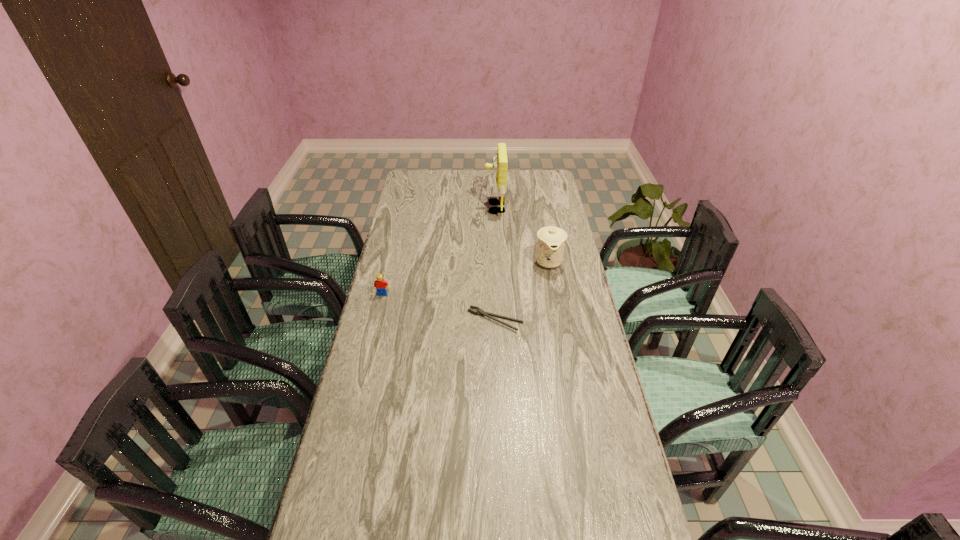
Locate an element on the screen. This screenshot has width=960, height=540. sponge is located at coordinates (500, 163).

Locate an element on the screen. The width and height of the screenshot is (960, 540). the farthest object is located at coordinates (500, 163).

Find the location of `the second tallest object`. the second tallest object is located at coordinates (551, 240).

You are a GUI agent. You are given a task and a screenshot of the screen. Output one action in this format:
    pyautogui.click(x=<x>, y=<y>)
    Task: Click on the chinaware
    
    Given the screenshot: What is the action you would take?
    pyautogui.click(x=551, y=240)

Find the location of a particular element. This screenshot has height=540, width=960. the third tallest object is located at coordinates (380, 284).

Where is `the leftmost object`? the leftmost object is located at coordinates (380, 284).

This screenshot has height=540, width=960. In order to click on the shortest object in this screenshot , I will do `click(481, 312)`.

You are a GUI agent. You are given a task and a screenshot of the screen. Output one action in this format:
    pyautogui.click(x=<x>, y=<y>)
    Task: Click on the nearest object
    This screenshot has width=960, height=540.
    Given the screenshot: What is the action you would take?
    pyautogui.click(x=481, y=312)

Locate an element on the screen. vacant space located 0.060m on the face of the tallest object is located at coordinates (471, 208).

What are the coordinates of `free space located 0.110m on the face of the tallest object` in the screenshot? It's located at (461, 208).